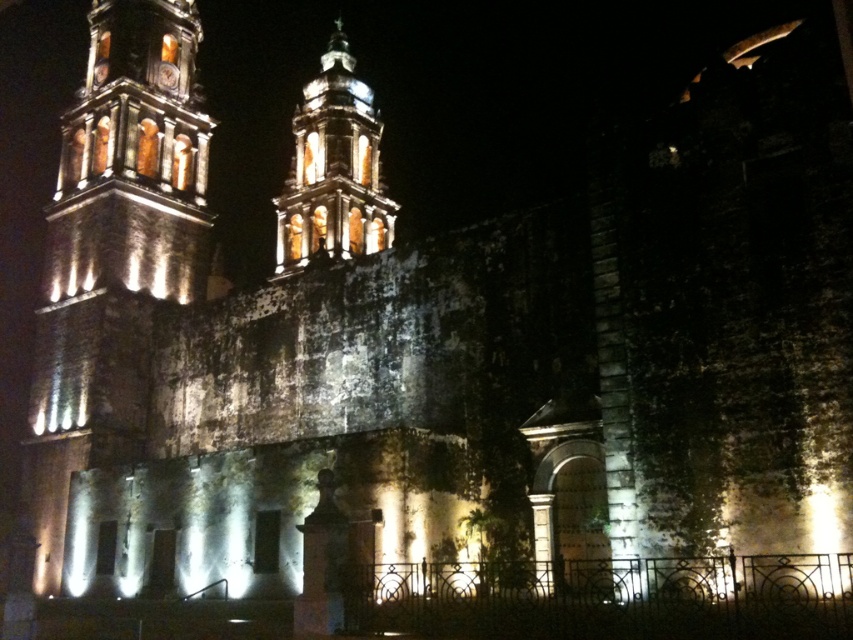
Question: Which point is closer to the camera?

Choices:
 (A) (351, 67)
 (B) (102, 282)

Answer: (B)

Question: Which point is closer to the camera?

Choices:
 (A) matte stone tower at left
 (B) matte stone tower at center

Answer: (A)

Question: Can you confirm if matte stone tower at left is thinner than matte stone tower at center?

Choices:
 (A) no
 (B) yes

Answer: (B)

Question: Is matte stone tower at left closer to the viewer compared to matte stone tower at center?

Choices:
 (A) no
 (B) yes

Answer: (B)

Question: Is matte stone tower at left below matte stone tower at center?

Choices:
 (A) yes
 (B) no

Answer: (A)

Question: Which point appears closest to the camera in this image?

Choices:
 (A) (358, 204)
 (B) (103, 84)

Answer: (B)